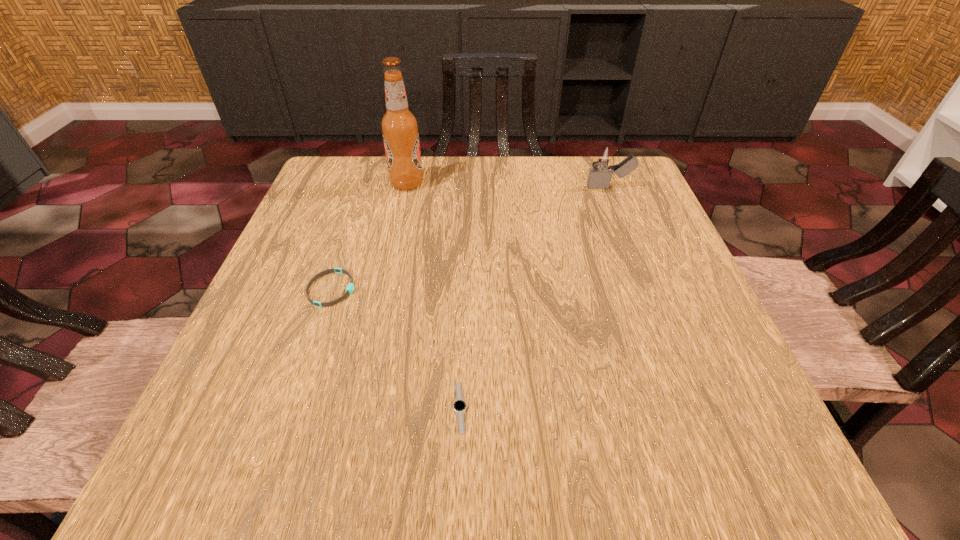
Image resolution: width=960 pixels, height=540 pixels. I want to click on free space at the right edge of the desktop, so click(x=682, y=381).

The image size is (960, 540). I want to click on vacant space at the far left corner of the desktop, so click(x=311, y=195).

This screenshot has width=960, height=540. Identify the location of vacant space at the near left corner. (206, 446).

Image resolution: width=960 pixels, height=540 pixels. In order to click on free space at the far right corner of the desktop in this screenshot , I will do `click(649, 192)`.

Find the location of a particular element. This screenshot has height=540, width=960. blank space at the near right corner of the desktop is located at coordinates (662, 459).

Where is `free space between the nearest object and the second object from left to right`? This screenshot has width=960, height=540. free space between the nearest object and the second object from left to right is located at coordinates tap(434, 295).

Find the location of a particular element. This screenshot has width=960, height=540. free space between the beer bottle and the second nearest object is located at coordinates (370, 237).

Locate an element on the screen. free space between the tallest object and the igniter is located at coordinates (508, 185).

Find the location of a particular element. The image size is (960, 540). free space between the tallest object and the rightmost object is located at coordinates (508, 185).

Where is `vacant space that is in between the tallest object and the rightmost object`? The image size is (960, 540). vacant space that is in between the tallest object and the rightmost object is located at coordinates (508, 185).